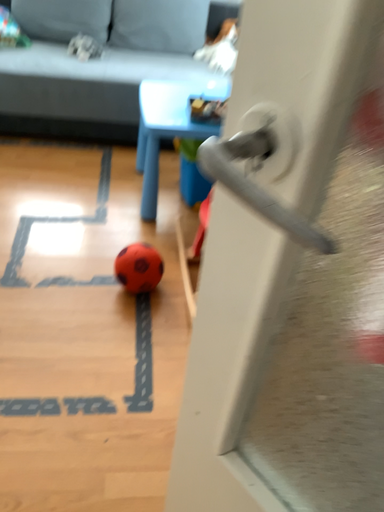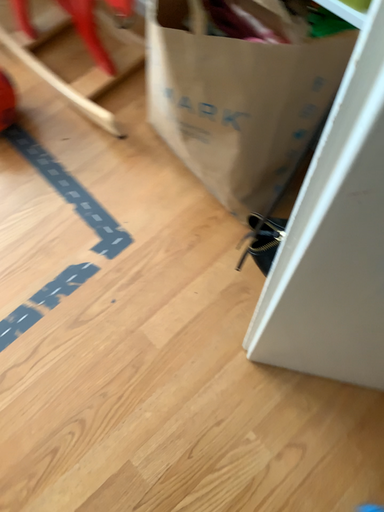
Question: How did the camera likely rotate when shooting the video?

Choices:
 (A) rotated upward
 (B) rotated downward

Answer: (B)